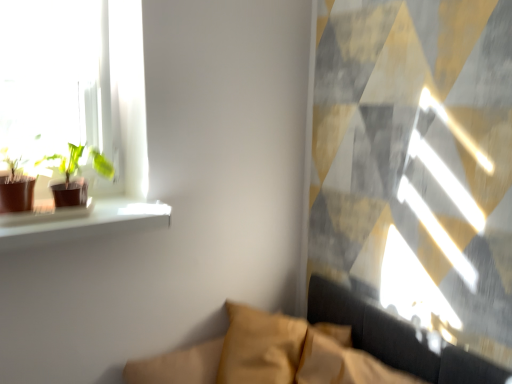
Question: Would you say green matte plant at left, the 2th houseplant from the left, is to the left or to the right of matte brown pot at left, which is the 2th houseplant from right to left, in the picture?

Choices:
 (A) left
 (B) right

Answer: (B)

Question: Considering the positions of green matte plant at left, the 1th houseplant viewed from the right, and matte brown pot at left, the 1th houseplant in the left-to-right sequence, in the image, is green matte plant at left, the 1th houseplant viewed from the right, wider or thinner than matte brown pot at left, the 1th houseplant in the left-to-right sequence,?

Choices:
 (A) wide
 (B) thin

Answer: (A)

Question: Based on their relative distances, which object is nearer to the green matte plant at left, the 1th houseplant viewed from the right?

Choices:
 (A) matte brown pot at left, the 1th houseplant in the left-to-right sequence
 (B) velvet mustard couch at lower center

Answer: (A)

Question: Which object is positioned farthest from the matte brown pot at left, the 1th houseplant in the left-to-right sequence?

Choices:
 (A) velvet mustard couch at lower center
 (B) green matte plant at left, the 1th houseplant viewed from the right

Answer: (A)